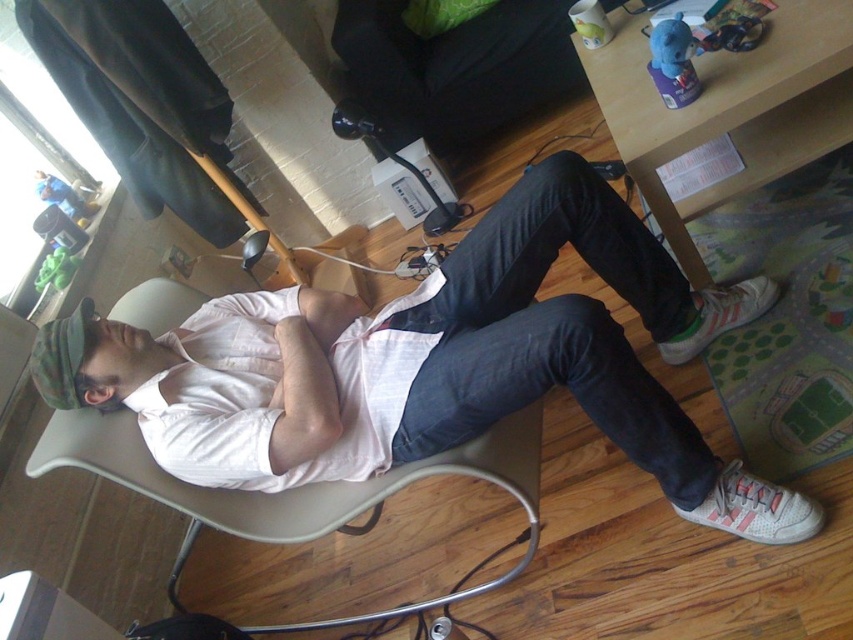
Question: Which of these objects is positioned closest to the white cotton shirt at center?

Choices:
 (A) wooden table at lower right
 (B) white plastic swivel chair at center
 (C) camouflage fabric cap at upper left

Answer: (B)

Question: Can you confirm if white cotton shirt at center is positioned to the right of white plastic swivel chair at center?

Choices:
 (A) yes
 (B) no

Answer: (A)

Question: Can you confirm if white cotton shirt at center is positioned to the right of white plastic swivel chair at center?

Choices:
 (A) no
 (B) yes

Answer: (B)

Question: Which object is the farthest from the white cotton shirt at center?

Choices:
 (A) white plastic swivel chair at center
 (B) wooden table at lower right

Answer: (B)

Question: Which object is the farthest from the wooden table at lower right?

Choices:
 (A) white cotton shirt at center
 (B) camouflage fabric cap at upper left

Answer: (B)

Question: Does white plastic swivel chair at center appear on the left side of camouflage fabric cap at upper left?

Choices:
 (A) no
 (B) yes

Answer: (A)